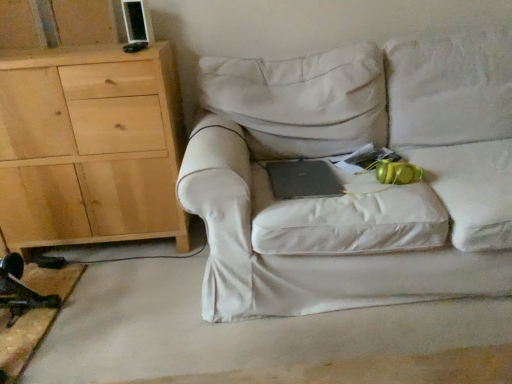
Question: From their relative heights in the image, would you say white fabric couch at center is taller or shorter than black matte laptop at center?

Choices:
 (A) tall
 (B) short

Answer: (A)

Question: Is point (404, 230) positioned closer to the camera than point (279, 180)?

Choices:
 (A) farther
 (B) closer

Answer: (B)

Question: Which of these objects is positioned farthest from the black matte laptop at center?

Choices:
 (A) natural wood cabinet at left
 (B) white fabric couch at center

Answer: (A)

Question: Considering the real-world distances, which object is farthest from the black matte laptop at center?

Choices:
 (A) white fabric couch at center
 (B) natural wood cabinet at left

Answer: (B)